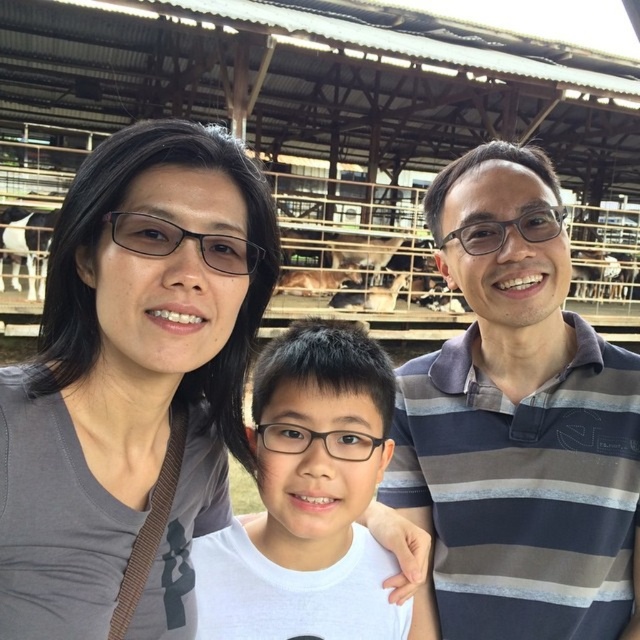
Question: Estimate the real-world distances between objects in this image. Which object is farther from the white matte shirt at center?

Choices:
 (A) gray matte shirt at upper left
 (B) striped cotton polo shirt at right

Answer: (B)

Question: Is gray matte shirt at upper left below striped cotton polo shirt at right?

Choices:
 (A) yes
 (B) no

Answer: (B)

Question: Which point is closer to the camera?

Choices:
 (A) (262, 442)
 (B) (529, 204)

Answer: (A)

Question: Can you confirm if striped cotton polo shirt at right is bigger than white matte shirt at center?

Choices:
 (A) yes
 (B) no

Answer: (A)

Question: Is gray matte shirt at upper left positioned at the back of striped cotton polo shirt at right?

Choices:
 (A) no
 (B) yes

Answer: (A)

Question: Considering the real-world distances, which object is farthest from the gray matte shirt at upper left?

Choices:
 (A) striped cotton polo shirt at right
 (B) white matte shirt at center

Answer: (A)